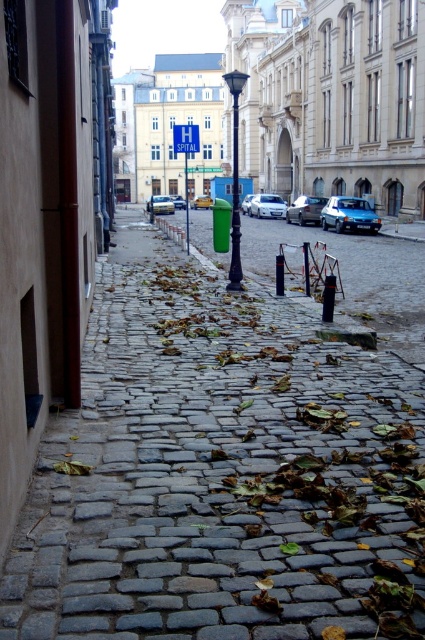
You are a pedestrian standing on the cobblestone street and want to cross to the beige building on the left. There are two cars in the way, a shiny silver sedan at center and a yellow matte car at center. Which car is closer to the left side of the street to avoid?

The yellow matte car at center is closer to the left side of the street because the shiny silver sedan at center is positioned on the right side of it.

You are a pedestrian standing on the cobblestone street and want to cross to the other side. There are two cars parked here, a shiny silver sedan at center and a matte white car at center. How far apart are these two cars from each other?

The shiny silver sedan at center and the matte white car at center are 30.64 feet apart.

You are standing at the point marked by coordinates point (220, 474) in the image. What is the material of the surface you are currently standing on?

The surface at point (220, 474) is cobblestone pavement.